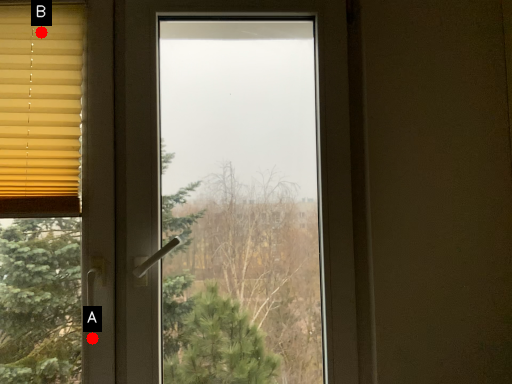
Question: Two points are circled on the image, labeled by A and B beside each circle. Among these points, which one is nearest to the camera?

Choices:
 (A) A is closer
 (B) B is closer

Answer: (A)